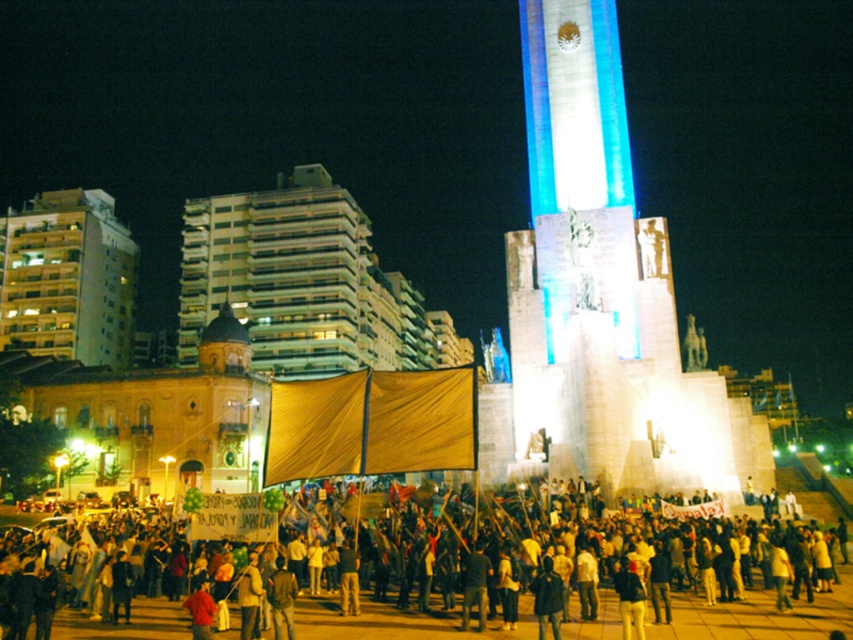
Question: Based on their relative distances, which object is farther from the yellowish concrete building at left?

Choices:
 (A) dark clothing at lower center
 (B) white stone monument at center

Answer: (B)

Question: Is white stone monument at center thinner than yellowish concrete building at left?

Choices:
 (A) yes
 (B) no

Answer: (A)

Question: Among these points, which one is farthest from the camera?

Choices:
 (A) coord(577,42)
 (B) coord(654,620)
 (C) coord(50,321)

Answer: (C)

Question: Is dark clothing at lower center closer to the viewer compared to yellowish concrete building at left?

Choices:
 (A) yes
 (B) no

Answer: (A)

Question: Does dark clothing at lower center have a lesser width compared to yellowish concrete building at left?

Choices:
 (A) yes
 (B) no

Answer: (B)

Question: Which point appears farthest from the camera in this image?

Choices:
 (A) (97, 557)
 (B) (647, 428)

Answer: (B)